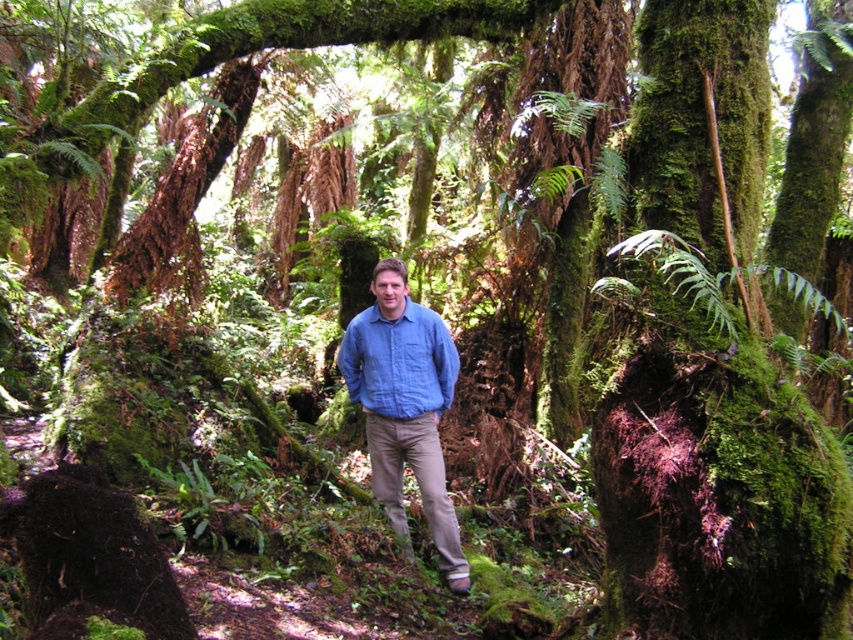
You are a tailor assessing two shirts in the forest scene. You see the blue cotton shirt at center and the matte blue shirt at center. Which shirt has a wider silhouette?

The blue cotton shirt at center might be wider than matte blue shirt at center.